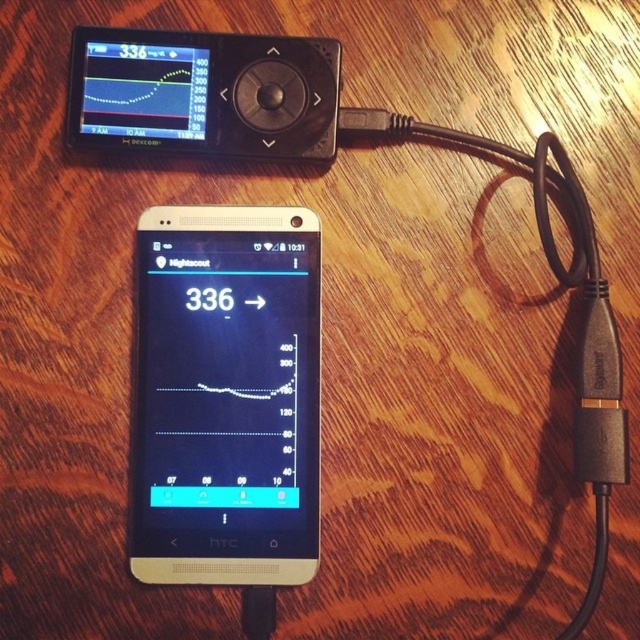
Can you confirm if matte black phone at center is wider than matte black device at upper left?

No, matte black phone at center is not wider than matte black device at upper left.

Which is behind, point (189, 520) or point (218, 88)?

The point (218, 88) is more distant.

You are a GUI agent. You are given a task and a screenshot of the screen. Output one action in this format:
    pyautogui.click(x=<x>, y=<y>)
    Task: Click on the matte black phone at center
    This screenshot has height=640, width=640.
    Given the screenshot: What is the action you would take?
    pyautogui.click(x=225, y=396)

Locate an element on the screen. matte black phone at center is located at coordinates (225, 396).

Who is higher up, matte black phone at center or black rubber cable at lower right?

Positioned higher is black rubber cable at lower right.

Does matte black phone at center lie in front of black rubber cable at lower right?

No, matte black phone at center is further to the viewer.

Which is in front, point (138, 387) or point (605, 460)?

Positioned in front is point (605, 460).

Identify the location of matte black phone at center. (225, 396).

Between matte black device at upper left and black rubber cable at lower right, which one has less height?

matte black device at upper left is shorter.

Can you confirm if matte black device at upper left is positioned to the right of black rubber cable at lower right?

Incorrect, matte black device at upper left is not on the right side of black rubber cable at lower right.

Does point (243, 97) come behind point (552, 237)?

Yes, point (243, 97) is farther from viewer.

Identify the location of matte black device at upper left. The image size is (640, 640). (204, 92).